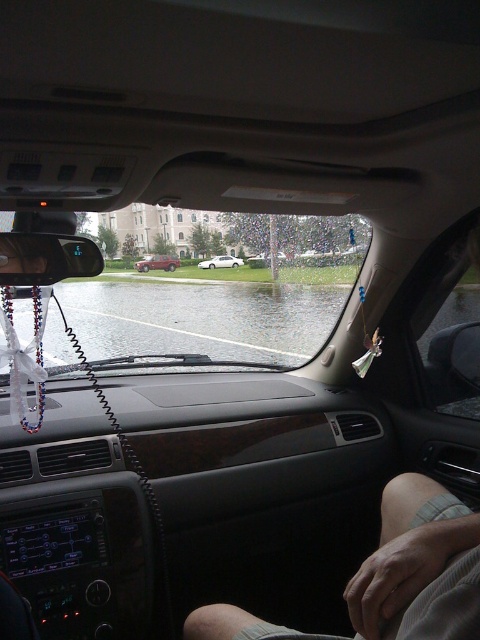
Question: Is matte plastic rearview mirror at upper left wider than metallic silver sedan at center?

Choices:
 (A) yes
 (B) no

Answer: (B)

Question: Can you confirm if skinny shorts at lower right is thinner than metallic silver sedan at center?

Choices:
 (A) no
 (B) yes

Answer: (B)

Question: Among these points, which one is nearest to the camera?

Choices:
 (A) (171, 268)
 (B) (67, 269)
 (C) (228, 260)
 (D) (187, 337)

Answer: (B)

Question: Which point is closer to the camera?

Choices:
 (A) (369, 564)
 (B) (195, 316)
 (C) (235, 266)
 (D) (33, 266)

Answer: (A)

Question: Where is clear liquid water at center located in relation to skinny shorts at lower right in the image?

Choices:
 (A) right
 (B) left

Answer: (B)

Question: Which point is closer to the camera?

Choices:
 (A) (34, 241)
 (B) (241, 259)
 (C) (170, 269)
 (D) (230, 285)

Answer: (A)